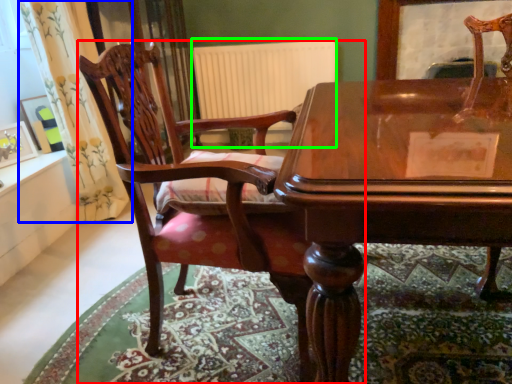
Question: Estimate the real-world distances between objects in this image. Which object is closer to chair (highlighted by a red box), curtain (highlighted by a blue box) or radiator (highlighted by a green box)?

Choices:
 (A) curtain
 (B) radiator

Answer: (A)